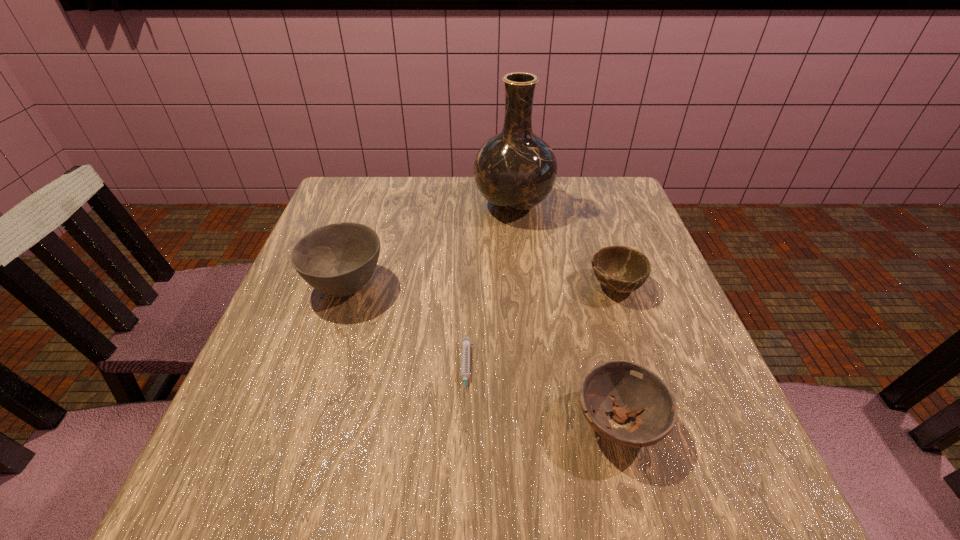
This screenshot has height=540, width=960. In order to click on the tallest object in this screenshot , I will do `click(515, 170)`.

Where is `the farthest object`? The height and width of the screenshot is (540, 960). the farthest object is located at coordinates (515, 170).

Find the location of a particular element. This screenshot has height=540, width=960. the tallest bowl is located at coordinates (339, 259).

In order to click on the leftmost bowl in this screenshot , I will do `click(339, 259)`.

This screenshot has height=540, width=960. What are the coordinates of `the nearest bowl` in the screenshot? It's located at (627, 389).

Identify the location of syringe. The height and width of the screenshot is (540, 960). (466, 342).

This screenshot has width=960, height=540. Identify the location of free location located 0.120m on the left of the vase. (430, 205).

This screenshot has height=540, width=960. I want to click on vacant space located on the back of the second tallest object, so click(372, 203).

The width and height of the screenshot is (960, 540). Find the location of `vacant space located on the left of the nearest bowl`. vacant space located on the left of the nearest bowl is located at coordinates (494, 422).

Locate an element on the screen. This screenshot has width=960, height=540. vacant position located 0.180m at the needle end of the shortest object is located at coordinates (461, 515).